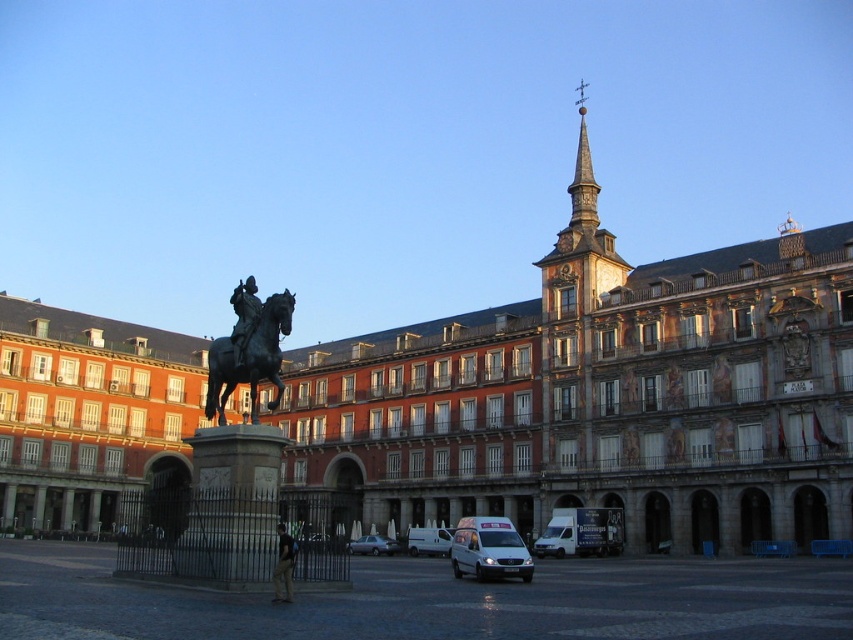
You are standing at the entrance of the plaza and want to take a photo of the equestrian statue. There is a point at coordinates point (583, 84) that you need to consider. Is this point closer to you or farther away than the statue?

The point at point (583, 84) is 172.67 meters away from the camera. Since the statue is the focal point centrally positioned in the plaza, it is likely closer than the point. Therefore, the point is farther away than the statue.